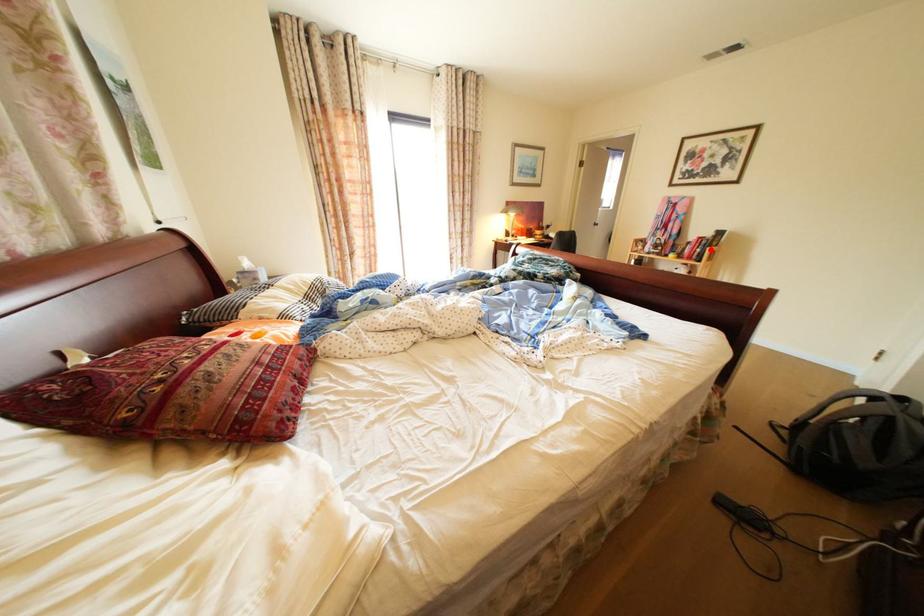
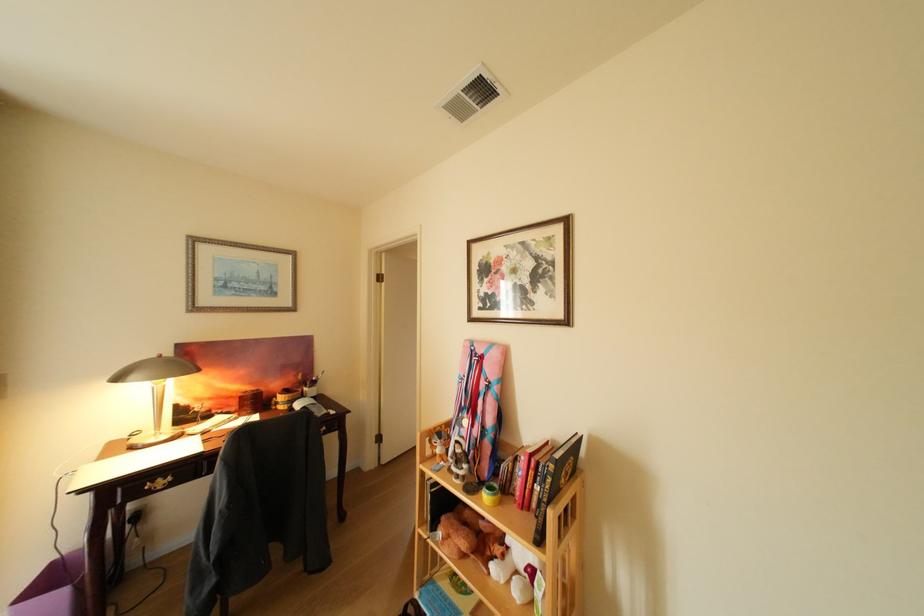
Question: I am providing you with two images of the same scene from different viewpoints. Image1 has a red point marked. In image2, the corresponding 3D location appears at what relative position? Reply with the corresponding letter.

Choices:
 (A) Closer
 (B) Farther

Answer: (B)